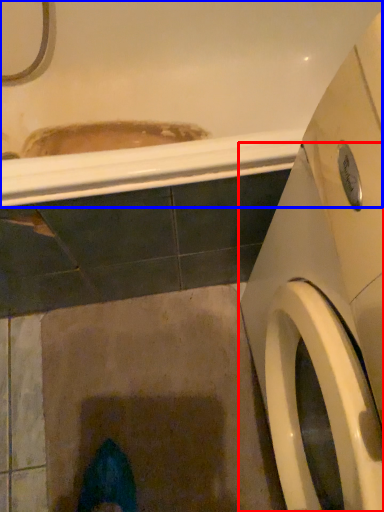
Question: Which object appears closest to the camera in this image, washing machine (highlighted by a red box) or bath (highlighted by a blue box)?

Choices:
 (A) washing machine
 (B) bath

Answer: (A)